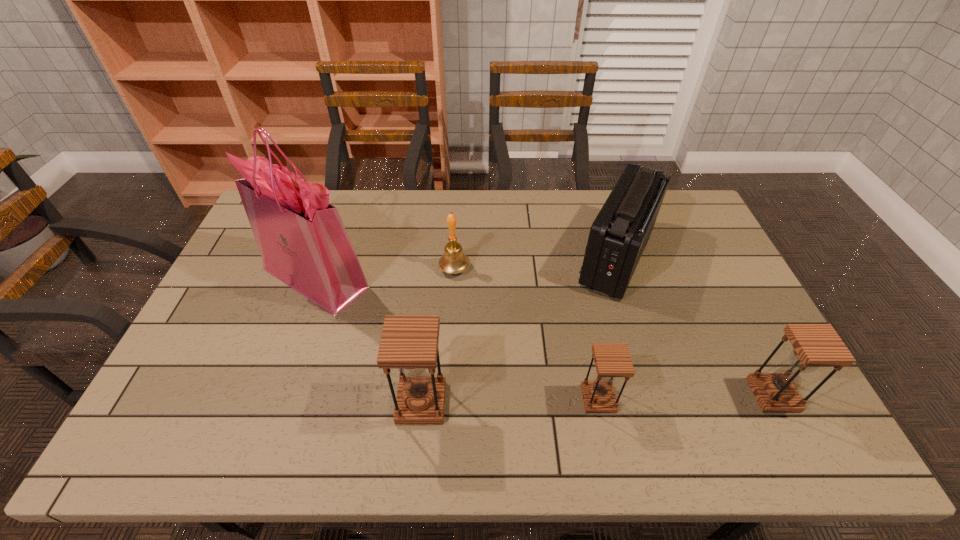
At what (x,y) coordinates should I click in order to perform the action: click on object located at the near right corner. Please return your answer as a coordinate pair (x, y). Looking at the image, I should click on (814, 345).

Where is `vacant space at the far edge of the desktop`? This screenshot has width=960, height=540. vacant space at the far edge of the desktop is located at coordinates (403, 213).

At what (x,y) coordinates should I click in order to perform the action: click on free space at the near edge. Please return your answer as a coordinate pair (x, y). This screenshot has width=960, height=540. Looking at the image, I should click on (541, 381).

The image size is (960, 540). I want to click on vacant region at the right edge of the desktop, so click(x=723, y=269).

Identify the location of free spot between the radio receiver and the leftmost hourglass. (519, 330).

Identify the location of vacant space that is in between the tallest hourglass and the tallest object. This screenshot has width=960, height=540. (369, 340).

Locate an element on the screen. vacant area between the rightmost hourglass and the bell is located at coordinates (613, 332).

Locate an element on the screen. The width and height of the screenshot is (960, 540). free space between the radio receiver and the bell is located at coordinates (536, 263).

I want to click on vacant area that lies between the second hourglass from left to right and the rightmost object, so click(x=685, y=397).

You are a GUI agent. You are given a task and a screenshot of the screen. Output one action in this format:
    pyautogui.click(x=<x>, y=<y>)
    Task: Click on the vacant space that is in between the tallest object and the second hourglass from right to left
    
    Given the screenshot: What is the action you would take?
    pyautogui.click(x=457, y=338)